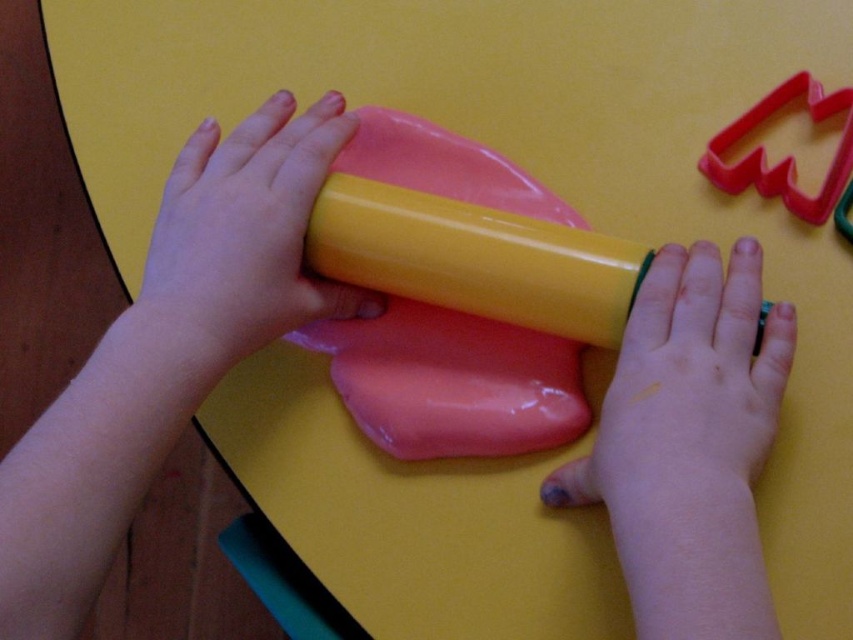
You are a child trying to choose between the smooth yellow rolling pin at center and the yellow glossy rolling pin at center to roll out a thicker piece of dough. Which rolling pin should you use and why?

You should use the yellow glossy rolling pin at center because its width is greater than the smooth yellow rolling pin at center, making it better suited for rolling out thicker dough.

You are standing 1 meter away from the yellow surface where the child is playing with the pinkish red substance. A point labeled as point (741, 392) is mentioned. Is this point closer to you or farther than your current position?

The point (741, 392) is 46.19 centimeters away from the viewer, which is closer than your current position of 1 meter away.